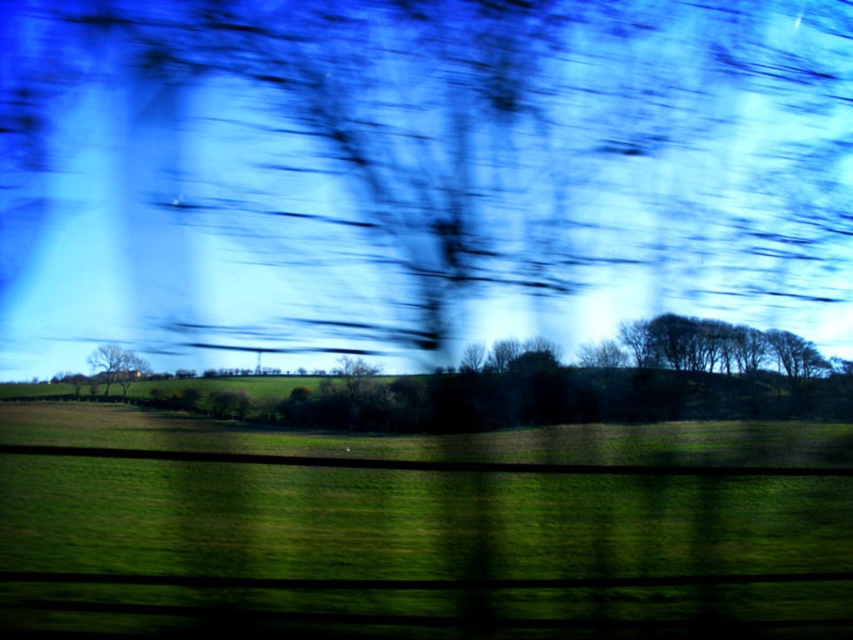
Question: Can you confirm if green grassy field at lower center is smaller than green matte tree at left?

Choices:
 (A) yes
 (B) no

Answer: (B)

Question: Which point is closer to the camera taking this photo?

Choices:
 (A) [x=91, y=358]
 (B) [x=21, y=468]

Answer: (A)

Question: Does green grassy field at lower center have a smaller size compared to green matte tree at left?

Choices:
 (A) yes
 (B) no

Answer: (B)

Question: Is green grassy field at lower center thinner than green matte tree at left?

Choices:
 (A) no
 (B) yes

Answer: (A)